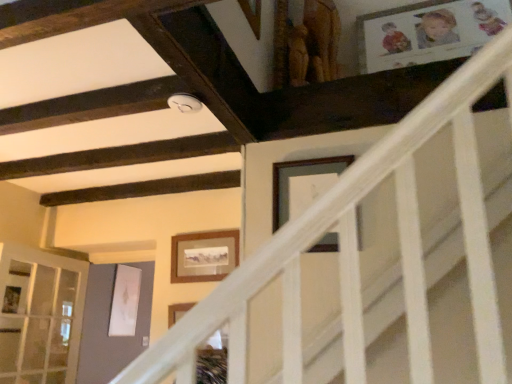
Question: In terms of width, does wooden picture frame at upper center, which ranks as the second picture frame in back-to-front order, look wider or thinner when compared to wooden framed picture at center, which ranks as the 1th picture frame in back-to-front order?

Choices:
 (A) wide
 (B) thin

Answer: (B)

Question: From the image's perspective, is wooden picture frame at upper center, which ranks as the 2th picture frame in bottom-to-top order, positioned above or below wooden framed picture at center, which ranks as the 1th picture frame in back-to-front order?

Choices:
 (A) below
 (B) above

Answer: (B)

Question: Which is farther from the wooden picture frame at upper center, which is the 1th picture frame in front-to-back order?

Choices:
 (A) wooden framed picture at center, the 2th picture frame viewed from the front
 (B) clear glass door at lower left

Answer: (B)

Question: Which of these objects is positioned closest to the wooden framed picture at center, which appears as the second picture frame when viewed from the right?

Choices:
 (A) wooden picture frame at upper center, which ranks as the 2th picture frame in bottom-to-top order
 (B) clear glass door at lower left

Answer: (A)